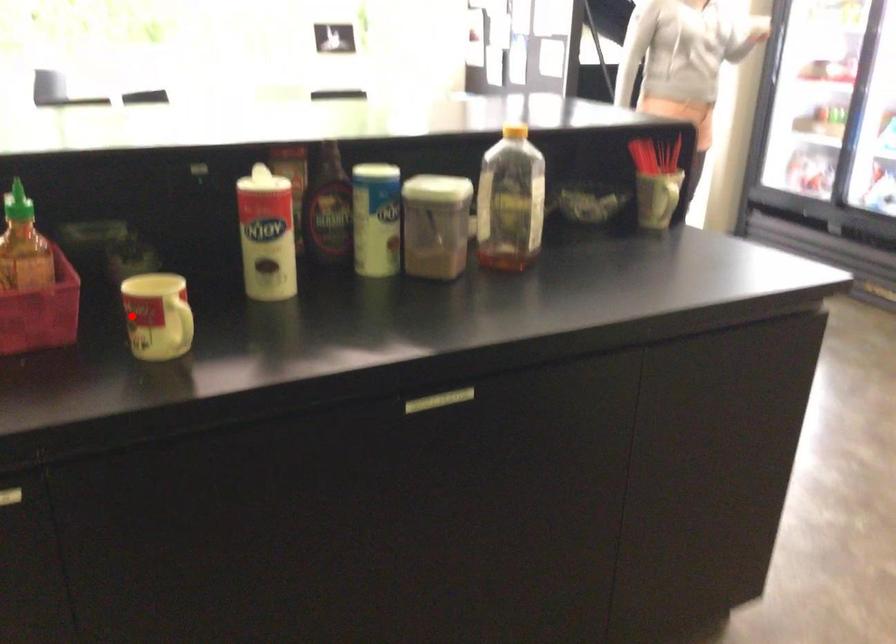
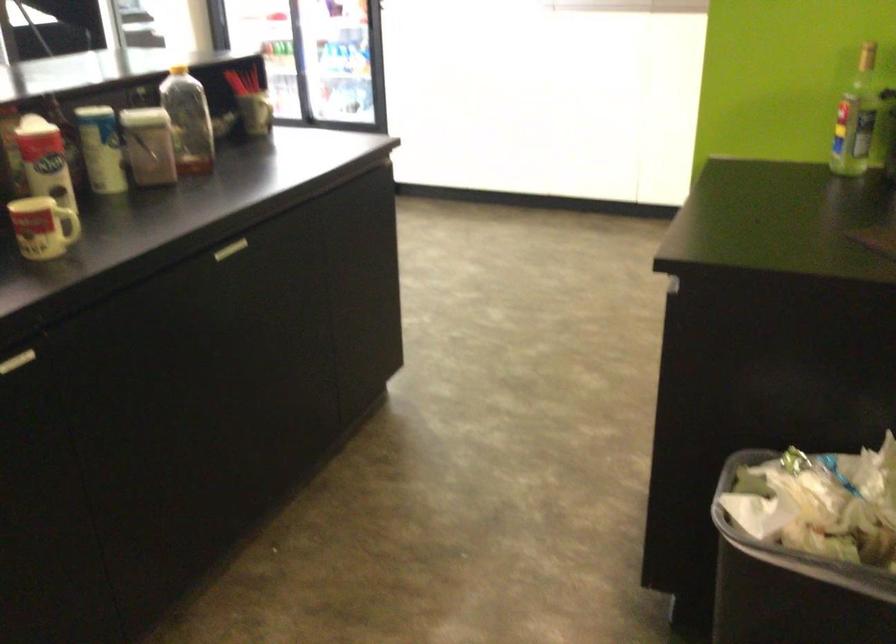
Question: I am providing you with two images of the same scene from different viewpoints. Given a red point in image1, look at the same physical point in image2. Is it:

Choices:
 (A) Closer to the viewpoint
 (B) Farther from the viewpoint

Answer: (B)